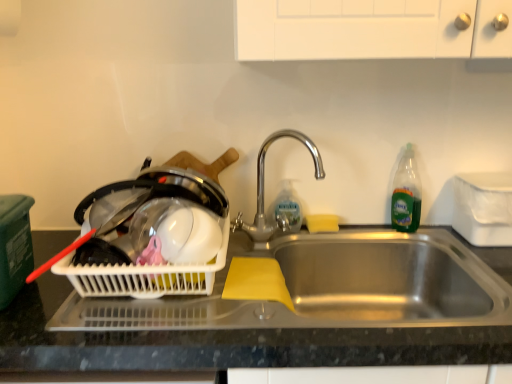
Identify the location of empty space that is ontop of white plastic container at right. (493, 176).